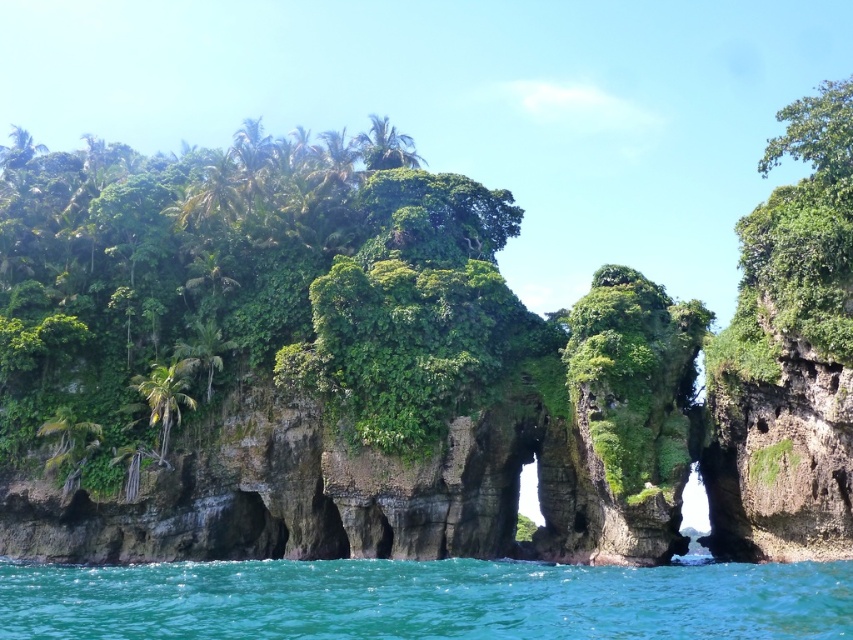
Who is lower down, turquoise liquid at lower center or green leafy palm tree at left?

turquoise liquid at lower center is lower down.

Does turquoise liquid at lower center appear under green leafy palm tree at left?

Correct, turquoise liquid at lower center is located below green leafy palm tree at left.

Where is `turquoise liquid at lower center`? turquoise liquid at lower center is located at coordinates (424, 600).